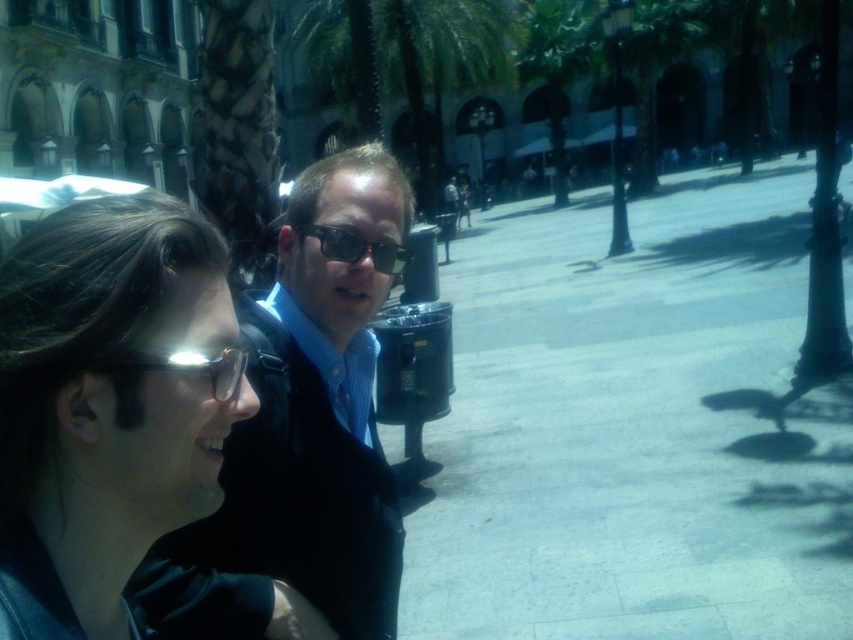
Question: Is gray concrete pavement at center bigger than matte black jacket at center?

Choices:
 (A) yes
 (B) no

Answer: (A)

Question: Observing the image, what is the correct spatial positioning of matte black jacket at center in reference to transparent plastic goggles at lower left?

Choices:
 (A) right
 (B) left

Answer: (A)

Question: Which object is closer to the camera taking this photo?

Choices:
 (A) green leafy palm tree at center
 (B) matte black jacket at center
 (C) gray concrete pavement at center

Answer: (B)

Question: Is transparent plastic goggles at lower left positioned at the back of black plastic sunglasses at center?

Choices:
 (A) no
 (B) yes

Answer: (A)

Question: Among these objects, which one is farthest from the camera?

Choices:
 (A) gray concrete pavement at center
 (B) transparent plastic goggles at lower left
 (C) matte black jacket at center
 (D) black plastic sunglasses at center

Answer: (D)

Question: Estimate the real-world distances between objects in this image. Which object is farther from the gray concrete pavement at center?

Choices:
 (A) matte black jacket at center
 (B) black plastic sunglasses at center

Answer: (B)